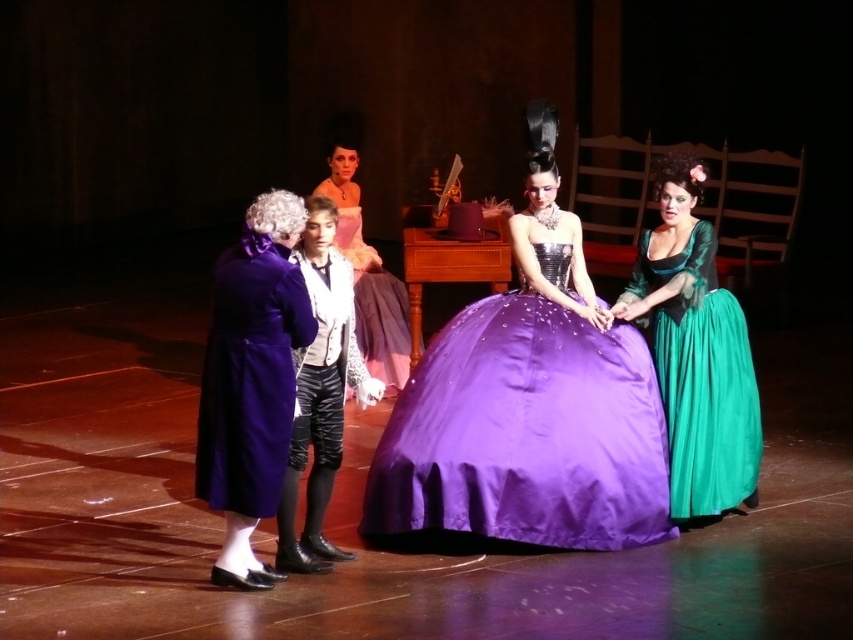
Is green satin dress at right thinner than leather pants at center?

In fact, green satin dress at right might be wider than leather pants at center.

Can you confirm if green satin dress at right is positioned to the left of leather pants at center?

In fact, green satin dress at right is to the right of leather pants at center.

Describe the element at coordinates (695, 349) in the screenshot. I see `green satin dress at right` at that location.

This screenshot has width=853, height=640. What are the coordinates of `green satin dress at right` in the screenshot? It's located at (695, 349).

Is velvet purple coat at left smaller than green satin dress at right?

Yes.

Does velvet purple coat at left come behind green satin dress at right?

No, velvet purple coat at left is in front of green satin dress at right.

Identify the location of velvet purple coat at left. (251, 381).

I want to click on velvet purple coat at left, so click(x=251, y=381).

Is green satin dress at right below matte white dress at center?

Correct, green satin dress at right is located below matte white dress at center.

Which is behind, point (709, 266) or point (386, 380)?

Positioned behind is point (386, 380).

Is point (688, 291) positioned in front of point (323, 179)?

Yes, point (688, 291) is closer to viewer.

What are the coordinates of `green satin dress at right` in the screenshot? It's located at (695, 349).